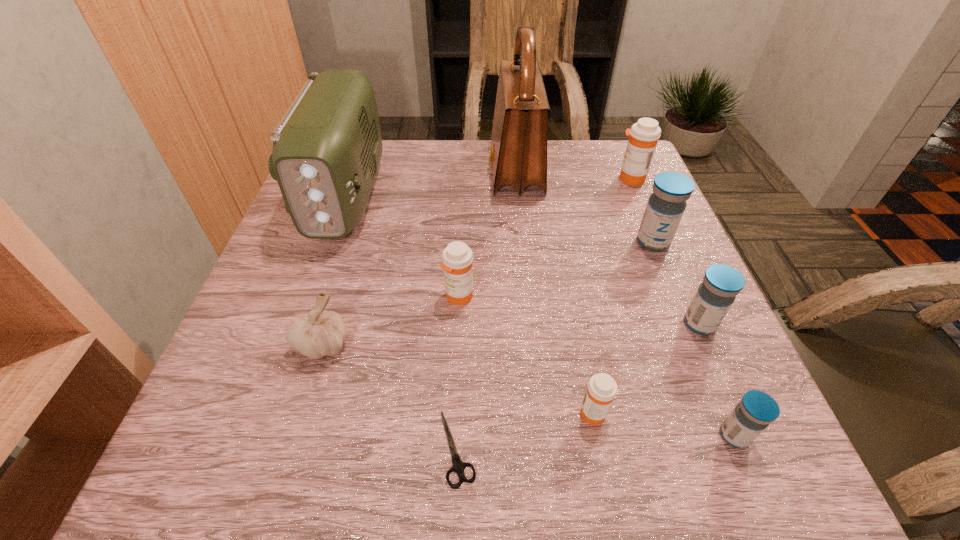
The image size is (960, 540). Find the location of `the tallest object`. the tallest object is located at coordinates (518, 157).

You are a GUI agent. You are given a task and a screenshot of the screen. Output one action in this format:
    pyautogui.click(x=<x>, y=<y>)
    Task: Click on the second tallest object
    
    Given the screenshot: What is the action you would take?
    pyautogui.click(x=327, y=147)

Identify the location of the biggest orange medicine. (644, 134).

What are the coordinates of `the rightmost orange medicine` in the screenshot? It's located at (644, 134).

Find the location of a particular element. the biggest blue medicine is located at coordinates (666, 205).

In order to click on the farthest blue medicine in this screenshot , I will do `click(666, 205)`.

I want to click on the third farthest medicine, so click(x=457, y=257).

Identify the location of the second farthest orange medicine. The width and height of the screenshot is (960, 540). (457, 257).

I want to click on the second nearest blue medicine, so click(715, 295).

Where is `the second biggest blue medicine`? This screenshot has width=960, height=540. the second biggest blue medicine is located at coordinates pos(715,295).